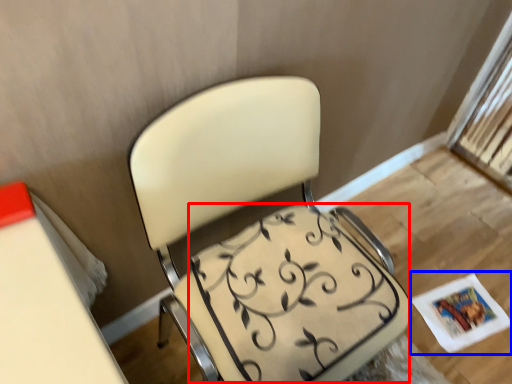
Question: Which object is further to the camera taking this photo, swivel chair (highlighted by a red box) or magazine (highlighted by a blue box)?

Choices:
 (A) swivel chair
 (B) magazine

Answer: (B)